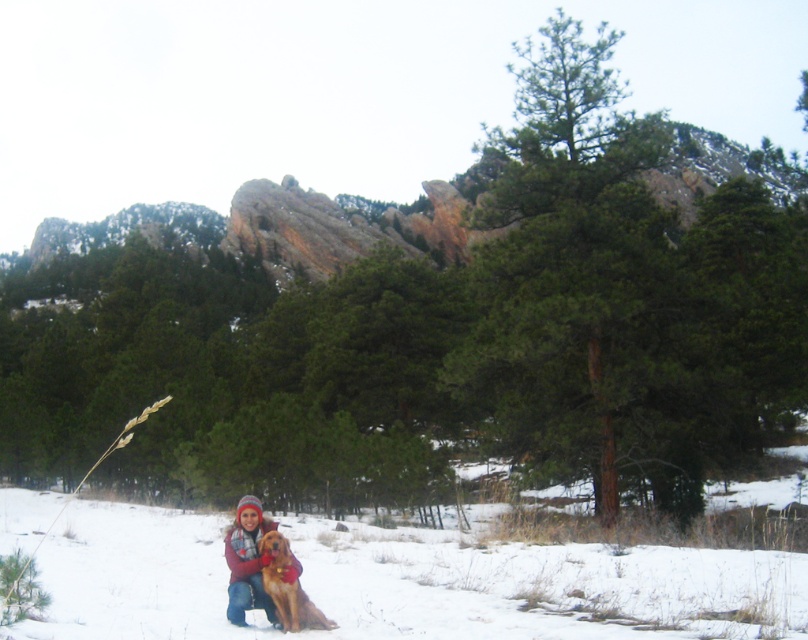
Does golden fur dog at lower center lie behind golden fur dog at center?

Yes, it is behind golden fur dog at center.

At what (x,y) coordinates should I click in order to perform the action: click on golden fur dog at lower center. Please return your answer as a coordinate pair (x, y). This screenshot has width=808, height=640. Looking at the image, I should click on (247, 563).

The width and height of the screenshot is (808, 640). Describe the element at coordinates (247, 563) in the screenshot. I see `golden fur dog at lower center` at that location.

You are a GUI agent. You are given a task and a screenshot of the screen. Output one action in this format:
    pyautogui.click(x=<x>, y=<y>)
    Task: Click on the golden fur dog at lower center
    The width and height of the screenshot is (808, 640).
    Given the screenshot: What is the action you would take?
    pyautogui.click(x=247, y=563)

Between white fluffy snow at lower center and golden fur dog at lower center, which one appears on the right side from the viewer's perspective?

Positioned to the right is golden fur dog at lower center.

Which of these two, white fluffy snow at lower center or golden fur dog at lower center, stands shorter?

golden fur dog at lower center

Where is `white fluffy snow at lower center`? white fluffy snow at lower center is located at coordinates (404, 582).

Can you confirm if white fluffy snow at lower center is positioned to the left of golden fur dog at center?

Indeed, white fluffy snow at lower center is positioned on the left side of golden fur dog at center.

Find the location of a particular element. The image size is (808, 640). white fluffy snow at lower center is located at coordinates (404, 582).